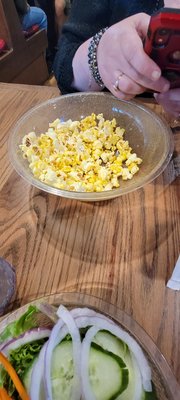
Locate an element on the screen. The image size is (180, 400). bowl is located at coordinates (131, 320).